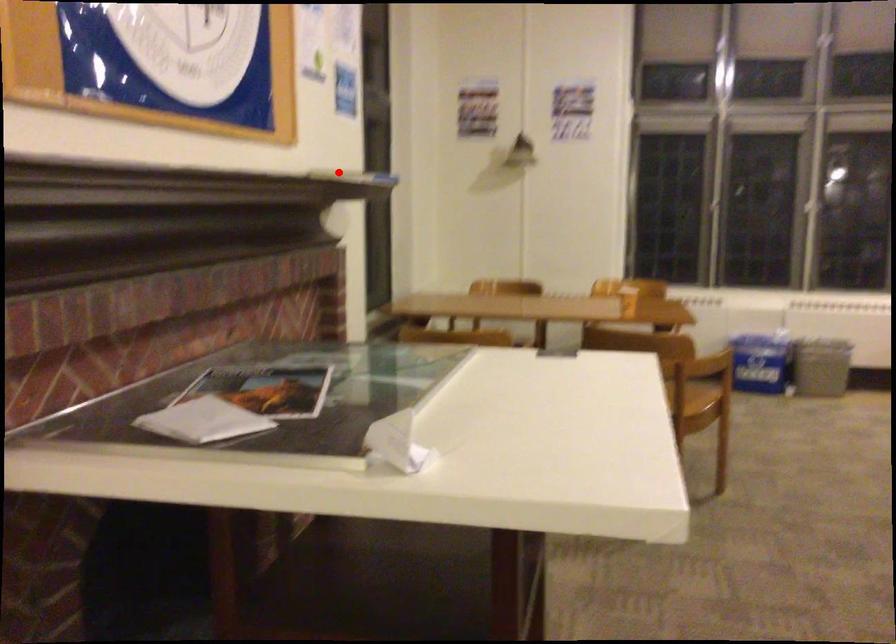
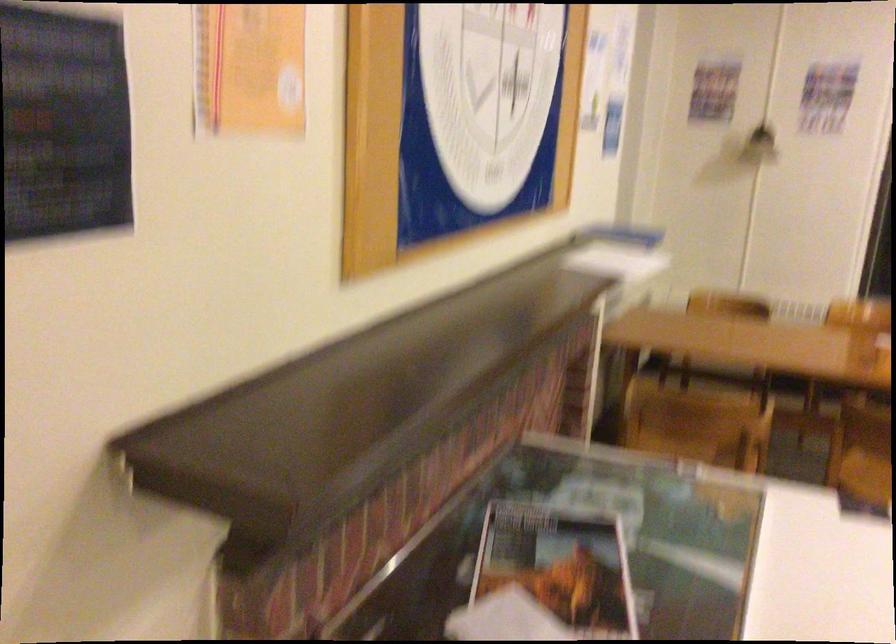
The point at the highlighted location is marked in the first image. Where is the corresponding point in the second image?

(617, 252)